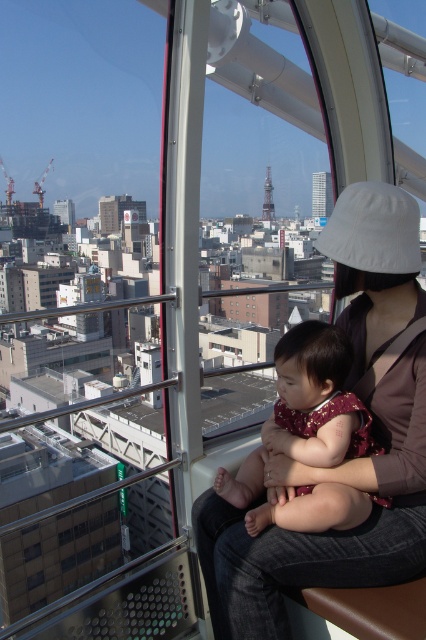
You are inside the Ferris wheel gondola and want to see the tall red and white tower outside. You have a white fabric hat at upper right and a transparent glass window at center. Which object is closer to you, the observer, so you can use it to get a better view?

The transparent glass window at center is closer to you than the white fabric hat at upper right, so you can use the transparent glass window at center to get a better view.

You are a parent holding a baby wrapped in a maroon fabric inside a Ferris wheel gondola. You want to show the baby the city view outside. Can you place the maroon fabric baby at center in front of the transparent glass window at center so that the baby can see the city through the window?

The maroon fabric baby at center is much taller than the transparent glass window at center, so placing the baby in front of the window would block the view. You should move the maroon fabric baby at center aside to allow the baby to see through the transparent glass window at center.

You are inside the Ferris wheel gondola and want to take a photo of the city. You notice two points marked in the gondola window. The first point is at coordinate point (325,458) and the second is at point (28,552). Which point is closer to your camera lens?

Point (325,458) is closer to the camera than point (28,552).